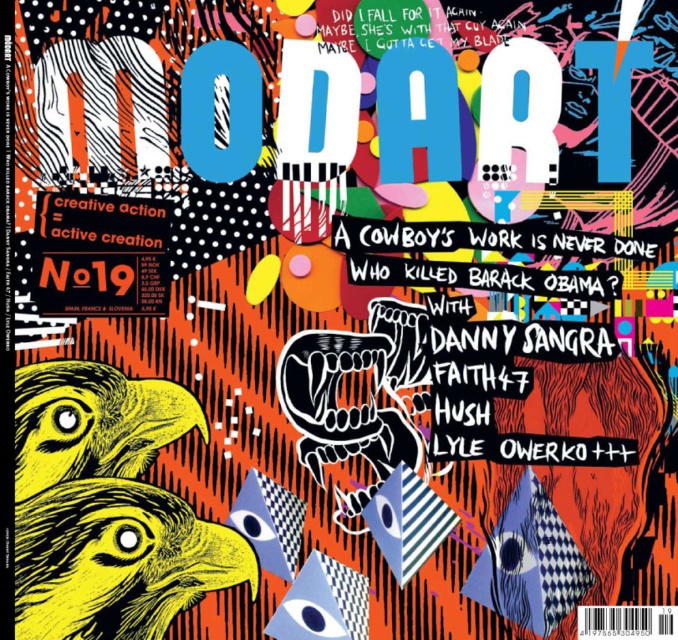
Question: Where is yellow linework eagle at lower left located in relation to yellow linocut eagle at lower left in the image?

Choices:
 (A) above
 (B) below

Answer: (B)

Question: Does yellow linework eagle at lower left have a greater width compared to yellow linocut eagle at lower left?

Choices:
 (A) no
 (B) yes

Answer: (B)

Question: Which object appears closest to the camera in this image?

Choices:
 (A) yellow linocut eagle at lower left
 (B) yellow linework eagle at lower left

Answer: (B)

Question: Is yellow linework eagle at lower left smaller than yellow linocut eagle at lower left?

Choices:
 (A) no
 (B) yes

Answer: (A)

Question: Among these objects, which one is farthest from the camera?

Choices:
 (A) yellow linework eagle at lower left
 (B) yellow linocut eagle at lower left

Answer: (B)

Question: Among these objects, which one is nearest to the camera?

Choices:
 (A) yellow linework eagle at lower left
 (B) yellow linocut eagle at lower left

Answer: (A)